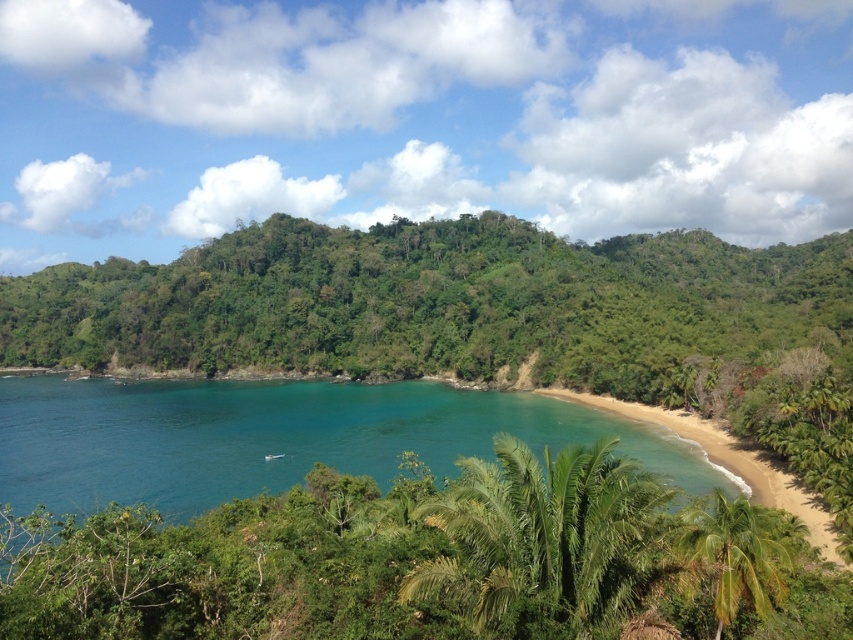
Who is taller, green leafy palm tree at lower center or green leafy palm tree at lower right?

green leafy palm tree at lower center

In the scene shown: Between green leafy palm tree at lower center and green leafy palm tree at lower right, which one has less height?

green leafy palm tree at lower right is shorter.

Find the location of `green leafy palm tree at lower center`. green leafy palm tree at lower center is located at coordinates (546, 538).

Who is more distant from viewer, (250, 422) or (720, 506)?

The point (250, 422) is more distant.

Which of these two, teal glossy water at center or green leafy palm tree at lower right, stands taller?

Standing taller between the two is teal glossy water at center.

Find the location of a particular element. teal glossy water at center is located at coordinates (281, 436).

Can you confirm if teal glossy water at center is bigger than green leafy palm tree at lower center?

Correct, teal glossy water at center is larger in size than green leafy palm tree at lower center.

Which is in front, point (393, 392) or point (442, 508)?

Positioned in front is point (442, 508).

At what (x,y) coordinates should I click in order to perform the action: click on teal glossy water at center. Please return your answer as a coordinate pair (x, y). This screenshot has width=853, height=640. Looking at the image, I should click on [x=281, y=436].